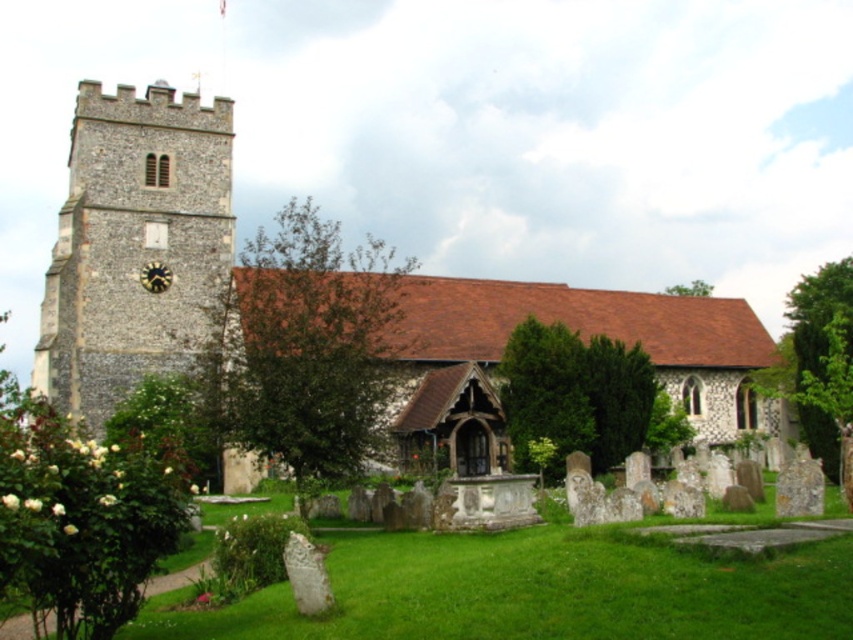
Question: Does green leafy bush at lower left appear on the right side of gold metallic clock at upper left?

Choices:
 (A) yes
 (B) no

Answer: (B)

Question: Can you confirm if stone church at center is thinner than stone clock tower at left?

Choices:
 (A) no
 (B) yes

Answer: (A)

Question: Among these objects, which one is farthest from the camera?

Choices:
 (A) green leafy tree at right
 (B) stone clock tower at left

Answer: (A)

Question: Does stone church at center appear on the right side of green leafy tree at right?

Choices:
 (A) no
 (B) yes

Answer: (A)

Question: Among these objects, which one is nearest to the camera?

Choices:
 (A) green leafy tree at upper right
 (B) stone clock tower at left
 (C) green textured tree at center
 (D) green leafy tree at center

Answer: (D)

Question: Estimate the real-world distances between objects in this image. Which object is closer to the green leafy tree at right?

Choices:
 (A) stone clock tower at left
 (B) green leafy tree at upper right
 (C) green leafy bush at lower left

Answer: (B)